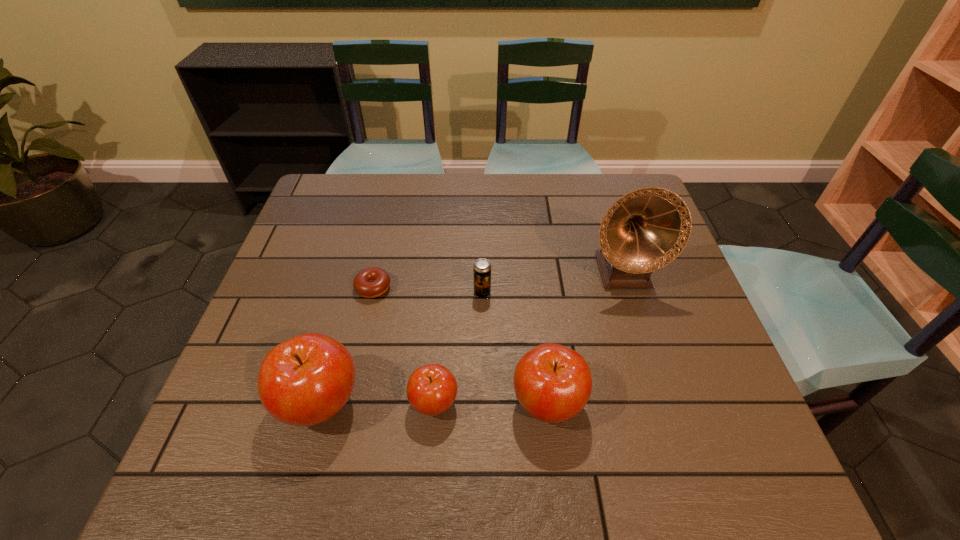
Where is `free region at the left edge`? Image resolution: width=960 pixels, height=540 pixels. free region at the left edge is located at coordinates (324, 286).

This screenshot has height=540, width=960. I want to click on vacant space at the far left corner of the desktop, so click(x=334, y=211).

Where is `blank space at the far right corner of the desktop`? blank space at the far right corner of the desktop is located at coordinates (598, 193).

Where is `vacant space in between the third tallest object and the third object from right to left`? vacant space in between the third tallest object and the third object from right to left is located at coordinates (515, 348).

Find the location of a particular element. The height and width of the screenshot is (540, 960). free space between the fourth object from left to right and the rightmost apple is located at coordinates (515, 348).

Image resolution: width=960 pixels, height=540 pixels. I want to click on free space between the leftmost apple and the third object from left to right, so click(x=377, y=402).

Find the location of a particular element. This screenshot has height=540, width=960. vacant region between the shortest apple and the rightmost object is located at coordinates (528, 337).

This screenshot has width=960, height=540. What are the coordinates of `free space between the leftmost apple and the fourth object from right to left` in the screenshot? It's located at coord(377,402).

Locate an element on the screen. The height and width of the screenshot is (540, 960). free spot between the beer can and the shortest apple is located at coordinates (458, 348).

I want to click on unoccupied position between the shortest object and the leftmost apple, so click(348, 345).